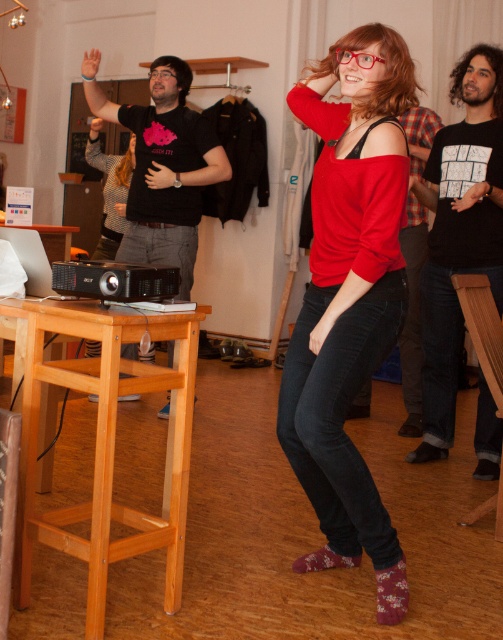
Is point (390, 97) positioned in front of point (438, 371)?

Yes, it is in front of point (438, 371).

Does matte red sweater at center have a lesser width compared to black cotton t-shirt at right?

Incorrect, matte red sweater at center's width is not less than black cotton t-shirt at right's.

Does point (308, 362) come farther from viewer compared to point (438, 220)?

No, it is not.

Where is `matte red sweater at center`? matte red sweater at center is located at coordinates (350, 298).

Is point (303, 404) more distant than point (485, 324)?

No, (303, 404) is closer to viewer.

Between point (293, 352) and point (488, 371), which one is positioned in front?

Point (293, 352) is more forward.

Between point (372, 84) and point (501, 532), which one is positioned behind?

The point (501, 532) is more distant.

You are a GUI agent. You are given a task and a screenshot of the screen. Output one action in this format:
    pyautogui.click(x=<x>, y=<y>)
    Task: Click on the matte red sweater at center
    This screenshot has width=503, height=640.
    Given the screenshot: What is the action you would take?
    pyautogui.click(x=350, y=298)

Is light brown wooden bar stool at lower left thinner than wooden bar stool at lower right?

No.

Who is positioned more to the right, light brown wooden bar stool at lower left or wooden bar stool at lower right?

wooden bar stool at lower right

Describe the element at coordinates (107, 442) in the screenshot. I see `light brown wooden bar stool at lower left` at that location.

This screenshot has height=640, width=503. I want to click on light brown wooden bar stool at lower left, so click(x=107, y=442).